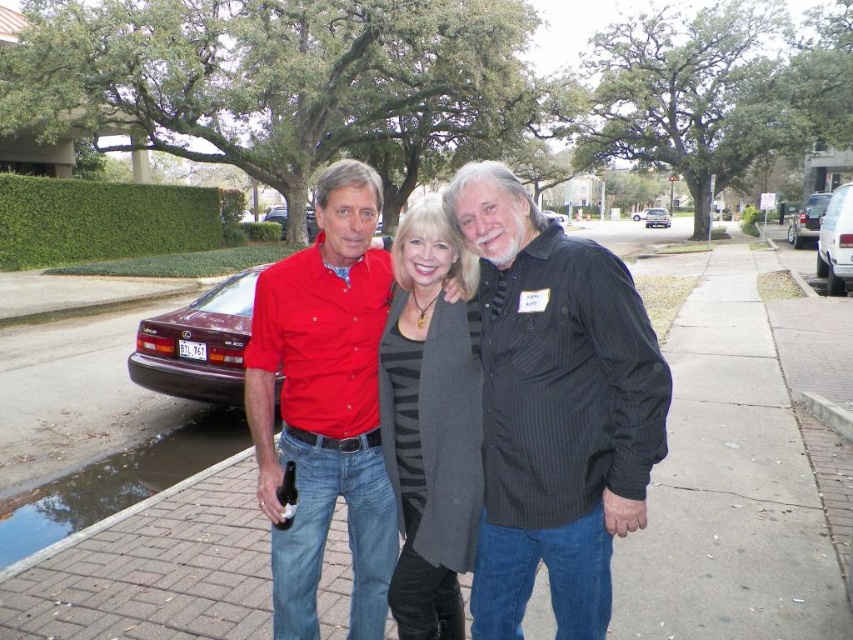
Can you confirm if brick pavement at center is positioned below maroon metallic sedan at center?

Indeed, brick pavement at center is positioned under maroon metallic sedan at center.

Is point (671, 600) less distant than point (653, 211)?

That is True.

Find the location of a particular element. Image resolution: width=853 pixels, height=640 pixels. brick pavement at center is located at coordinates (728, 481).

Does brick pavement at center have a larger size compared to black pinstripe shirt at center?

Correct, brick pavement at center is larger in size than black pinstripe shirt at center.

Which is in front, point (653, 589) or point (495, 611)?

Point (495, 611)

Is point (792, 627) positioned behind point (526, 320)?

Yes, it is behind point (526, 320).

What are the coordinates of `brick pavement at center` in the screenshot? It's located at (x=728, y=481).

From the picture: Is white glossy van at right to the left of metallic silver sedan at right from the viewer's perspective?

Correct, you'll find white glossy van at right to the left of metallic silver sedan at right.

Between white glossy van at right and metallic silver sedan at right, which one has more height?

Standing taller between the two is metallic silver sedan at right.

Is point (827, 273) farther from viewer compared to point (791, 218)?

That is False.

This screenshot has width=853, height=640. I want to click on white glossy van at right, so click(834, 241).